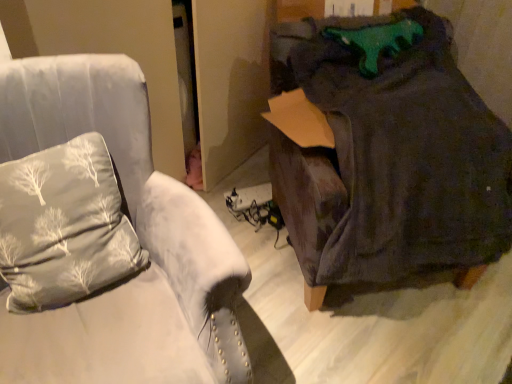
What do you see at coordinates (133, 227) in the screenshot? I see `velvet gray armchair at left` at bounding box center [133, 227].

In order to click on silky gray pillow at left in this screenshot , I will do [64, 226].

Are dark gray fabric bean bag at right and silky gray pillow at left far apart?

No, there isn't a large distance between dark gray fabric bean bag at right and silky gray pillow at left.

Considering the positions of objects dark gray fabric bean bag at right and silky gray pillow at left in the image provided, who is more to the left, dark gray fabric bean bag at right or silky gray pillow at left?

silky gray pillow at left.

Find the location of `bean bag chair below the silky gray pillow at left (from a real-world perspective)`. bean bag chair below the silky gray pillow at left (from a real-world perspective) is located at coordinates (388, 154).

Looking at their sizes, would you say dark gray fabric bean bag at right is wider or thinner than silky gray pillow at left?

dark gray fabric bean bag at right is wider than silky gray pillow at left.

Considering the relative positions of silky gray pillow at left and dark gray fabric bean bag at right in the image provided, is silky gray pillow at left to the left of dark gray fabric bean bag at right from the viewer's perspective?

Indeed, silky gray pillow at left is positioned on the left side of dark gray fabric bean bag at right.

Does silky gray pillow at left come behind dark gray fabric bean bag at right?

No, it is not.

Considering the sizes of objects silky gray pillow at left and dark gray fabric bean bag at right in the image provided, who is shorter, silky gray pillow at left or dark gray fabric bean bag at right?

silky gray pillow at left.

Is velvet gray armchair at left situated inside dark gray fabric bean bag at right or outside?

velvet gray armchair at left cannot be found inside dark gray fabric bean bag at right.

Can you tell me how much velvet gray armchair at left and dark gray fabric bean bag at right differ in facing direction?

The angular difference between velvet gray armchair at left and dark gray fabric bean bag at right is 16.9 degrees.

Which is more to the right, velvet gray armchair at left or dark gray fabric bean bag at right?

From the viewer's perspective, dark gray fabric bean bag at right appears more on the right side.

From the image's perspective, which is below, velvet gray armchair at left or dark gray fabric bean bag at right?

velvet gray armchair at left.

Who is taller, velvet gray armchair at left or silky gray pillow at left?

velvet gray armchair at left.

Is velvet gray armchair at left to the right of silky gray pillow at left from the viewer's perspective?

Correct, you'll find velvet gray armchair at left to the right of silky gray pillow at left.

Which object is further away from the camera, velvet gray armchair at left or silky gray pillow at left?

silky gray pillow at left is further from the camera.

What's the angular difference between dark gray fabric bean bag at right and velvet gray armchair at left's facing directions?

dark gray fabric bean bag at right and velvet gray armchair at left are facing 16.9 degrees away from each other.

Is dark gray fabric bean bag at right turned away from velvet gray armchair at left?

No.

From the image's perspective, between dark gray fabric bean bag at right and velvet gray armchair at left, who is located below?

velvet gray armchair at left is shown below in the image.

Measure the distance between dark gray fabric bean bag at right and velvet gray armchair at left.

A distance of 25.35 inches exists between dark gray fabric bean bag at right and velvet gray armchair at left.

Who is bigger, silky gray pillow at left or velvet gray armchair at left?

Bigger between the two is velvet gray armchair at left.

Is silky gray pillow at left oriented towards velvet gray armchair at left?

Yes, silky gray pillow at left is facing velvet gray armchair at left.

How distant is silky gray pillow at left from velvet gray armchair at left?

silky gray pillow at left and velvet gray armchair at left are 4.93 inches apart from each other.

Is point (97, 157) closer or farther from the camera than point (180, 275)?

Clearly, point (97, 157) is more distant from the camera than point (180, 275).

This screenshot has width=512, height=384. Find the location of `pillow in front of the dark gray fabric bean bag at right`. pillow in front of the dark gray fabric bean bag at right is located at coordinates (64, 226).

Find the location of a particular element. The height and width of the screenshot is (384, 512). pillow below the dark gray fabric bean bag at right (from the image's perspective) is located at coordinates (64, 226).

Estimate the real-world distances between objects in this image. Which object is closer to velvet gray armchair at left, silky gray pillow at left or dark gray fabric bean bag at right?

Based on the image, silky gray pillow at left appears to be nearer to velvet gray armchair at left.

From the image, which object appears to be farther from velvet gray armchair at left, dark gray fabric bean bag at right or silky gray pillow at left?

Among the two, dark gray fabric bean bag at right is located further to velvet gray armchair at left.

From the image, which object appears to be farther from dark gray fabric bean bag at right, silky gray pillow at left or velvet gray armchair at left?

Among the two, silky gray pillow at left is located further to dark gray fabric bean bag at right.

Estimate the real-world distances between objects in this image. Which object is closer to silky gray pillow at left, velvet gray armchair at left or dark gray fabric bean bag at right?

Among the two, velvet gray armchair at left is located nearer to silky gray pillow at left.

Considering their positions, is dark gray fabric bean bag at right positioned further to silky gray pillow at left than velvet gray armchair at left?

dark gray fabric bean bag at right is positioned further to the anchor silky gray pillow at left.

Which object lies further to the anchor point dark gray fabric bean bag at right, velvet gray armchair at left or silky gray pillow at left?

silky gray pillow at left.

Where is `furniture situated between silky gray pillow at left and dark gray fabric bean bag at right from left to right`? furniture situated between silky gray pillow at left and dark gray fabric bean bag at right from left to right is located at coordinates (133, 227).